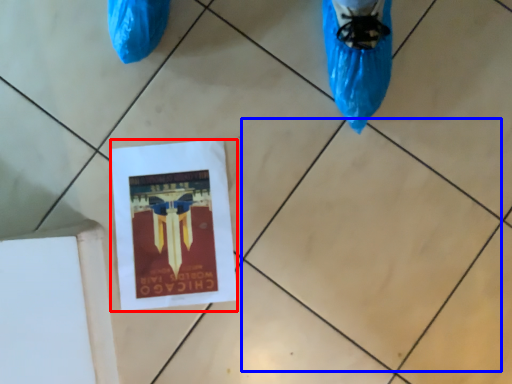
Question: Which object is closer to the camera taking this photo, flyer (highlighted by a red box) or tile (highlighted by a blue box)?

Choices:
 (A) flyer
 (B) tile

Answer: (B)